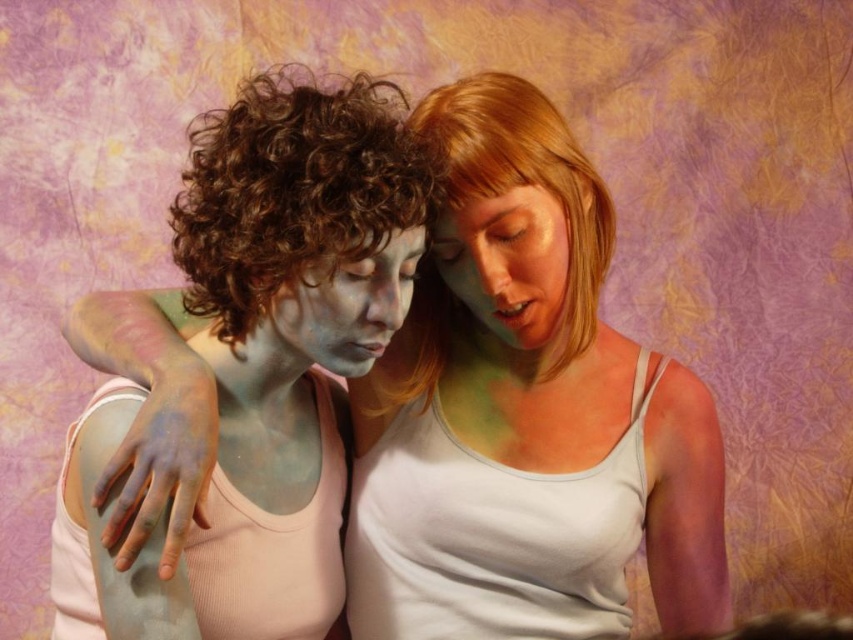
You are an art conservator examining the image. You notice two faces at the center of the scene described as green matte face at center and matte paint face at center. Based on their positioning, which face appears to be on top?

The green matte face at center is positioned over matte paint face at center, so it appears on top.

From the picture: You are an artist analyzing the composition of this image. The scene has two people against a textured background with warm tones. You notice the point labeled as point (x=525, y=410). What does this point represent?

The point (x=525, y=410) represents the matte painted face at center.